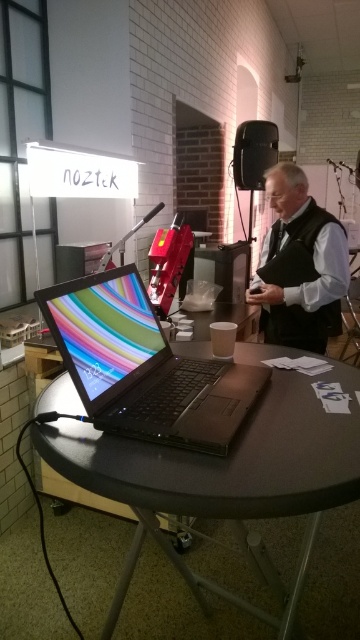
Question: Can you confirm if shiny black laptop at center is bigger than dark gray vest at center?

Choices:
 (A) no
 (B) yes

Answer: (A)

Question: Which point appears closest to the camera in this image?

Choices:
 (A) (120, 268)
 (B) (297, 390)
 (C) (284, 266)

Answer: (B)

Question: Among these points, which one is nearest to the camera?

Choices:
 (A) (342, 273)
 (B) (227, 408)

Answer: (B)

Question: Does black plastic table at center appear over shiny black laptop at center?

Choices:
 (A) yes
 (B) no

Answer: (B)

Question: Among these objects, which one is nearest to the camera?

Choices:
 (A) dark gray vest at center
 (B) shiny black laptop at center
 (C) black plastic table at center

Answer: (C)

Question: Does black plastic table at center have a larger size compared to dark gray vest at center?

Choices:
 (A) yes
 (B) no

Answer: (B)